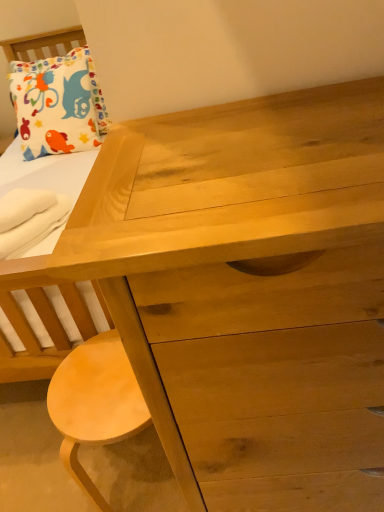
Image resolution: width=384 pixels, height=512 pixels. What do you see at coordinates (23, 206) in the screenshot?
I see `white soft towel at lower left` at bounding box center [23, 206].

Image resolution: width=384 pixels, height=512 pixels. What do you see at coordinates (95, 403) in the screenshot?
I see `light brown wood stool at lower left` at bounding box center [95, 403].

At what (x,y) coordinates should I click in order to perform the action: click on white soft towel at lower left. Please return your answer as a coordinate pair (x, y). Looking at the image, I should click on (23, 206).

Between white soft towel at lower left and light brown wood stool at lower left, which one has more height?

Standing taller between the two is light brown wood stool at lower left.

How much distance is there between white soft towel at lower left and light brown wood stool at lower left?

The distance of white soft towel at lower left from light brown wood stool at lower left is 58.21 centimeters.

Who is bigger, white soft towel at lower left or light brown wood stool at lower left?

Bigger between the two is light brown wood stool at lower left.

From the picture: Could you tell me if white soft towel at lower left is turned towards light brown wood stool at lower left?

No, white soft towel at lower left is not facing towards light brown wood stool at lower left.

Where is `pillow on the left of light brown wood stool at lower left`? This screenshot has width=384, height=512. pillow on the left of light brown wood stool at lower left is located at coordinates (58, 104).

Which is correct: light brown wood stool at lower left is inside white cotton pillow at upper left, or outside of it?

The correct answer is: outside.

Considering the relative positions of light brown wood stool at lower left and white cotton pillow at upper left in the image provided, is light brown wood stool at lower left to the left of white cotton pillow at upper left from the viewer's perspective?

Incorrect, light brown wood stool at lower left is not on the left side of white cotton pillow at upper left.

Who is shorter, light brown wood stool at lower left or white cotton pillow at upper left?

Standing shorter between the two is light brown wood stool at lower left.

Which object is more forward, white cotton pillow at upper left or white soft towel at lower left?

white soft towel at lower left.

From the image's perspective, which one is positioned lower, white cotton pillow at upper left or white soft towel at lower left?

From the image's view, white soft towel at lower left is below.

From a real-world perspective, which is physically above, white cotton pillow at upper left or white soft towel at lower left?

From a 3D spatial view, white cotton pillow at upper left is above.

Considering the relative sizes of white cotton pillow at upper left and white soft towel at lower left in the image provided, is white cotton pillow at upper left wider than white soft towel at lower left?

Correct, the width of white cotton pillow at upper left exceeds that of white soft towel at lower left.

In order to click on pillow that is above the white soft towel at lower left (from the image's perspective) in this screenshot , I will do `click(58, 104)`.

Is white soft towel at lower left aimed at white cotton pillow at upper left?

No, white soft towel at lower left is not aimed at white cotton pillow at upper left.

Which object is positioned more to the left, white soft towel at lower left or white cotton pillow at upper left?

white cotton pillow at upper left is more to the left.

This screenshot has width=384, height=512. Find the location of `stool below the white soft towel at lower left (from the image's perspective)`. stool below the white soft towel at lower left (from the image's perspective) is located at coordinates (95, 403).

Is light brown wood stool at lower left looking in the opposite direction of white soft towel at lower left?

light brown wood stool at lower left does not have its back to white soft towel at lower left.

Can you confirm if light brown wood stool at lower left is wider than white soft towel at lower left?

Indeed, light brown wood stool at lower left has a greater width compared to white soft towel at lower left.

Between light brown wood stool at lower left and white soft towel at lower left, which one appears on the right side from the viewer's perspective?

Positioned to the right is light brown wood stool at lower left.

Are white cotton pillow at upper left and light brown wood stool at lower left far apart?

Yes, white cotton pillow at upper left and light brown wood stool at lower left are quite far apart.

The width and height of the screenshot is (384, 512). Identify the location of stool that is below the white cotton pillow at upper left (from the image's perspective). 95,403.

Which is more to the left, white cotton pillow at upper left or light brown wood stool at lower left?

white cotton pillow at upper left is more to the left.

Does white cotton pillow at upper left have a larger size compared to light brown wood stool at lower left?

Indeed, white cotton pillow at upper left has a larger size compared to light brown wood stool at lower left.

Identify the location of stool on the right of white soft towel at lower left. This screenshot has height=512, width=384. (95, 403).

The width and height of the screenshot is (384, 512). What are the coordinates of `stool below the white cotton pillow at upper left (from the image's perspective)` in the screenshot? It's located at (95, 403).

From the image, which object appears to be nearer to white cotton pillow at upper left, light brown wood stool at lower left or white soft towel at lower left?

Among the two, white soft towel at lower left is located nearer to white cotton pillow at upper left.

Considering their positions, is light brown wood stool at lower left positioned further to white soft towel at lower left than white cotton pillow at upper left?

The object further to white soft towel at lower left is white cotton pillow at upper left.

Estimate the real-world distances between objects in this image. Which object is closer to light brown wood stool at lower left, white cotton pillow at upper left or white soft towel at lower left?

white soft towel at lower left is positioned closer to the anchor light brown wood stool at lower left.

Based on their spatial positions, is white soft towel at lower left or light brown wood stool at lower left further from white cotton pillow at upper left?

light brown wood stool at lower left lies further to white cotton pillow at upper left than the other object.

When comparing their distances from light brown wood stool at lower left, does white soft towel at lower left or white cotton pillow at upper left seem closer?

white soft towel at lower left lies closer to light brown wood stool at lower left than the other object.

Considering their positions, is white cotton pillow at upper left positioned closer to white soft towel at lower left than light brown wood stool at lower left?

light brown wood stool at lower left is closer to white soft towel at lower left.

Image resolution: width=384 pixels, height=512 pixels. In order to click on cloth between white cotton pillow at upper left and light brown wood stool at lower left in the up-down direction in this screenshot , I will do `click(23, 206)`.